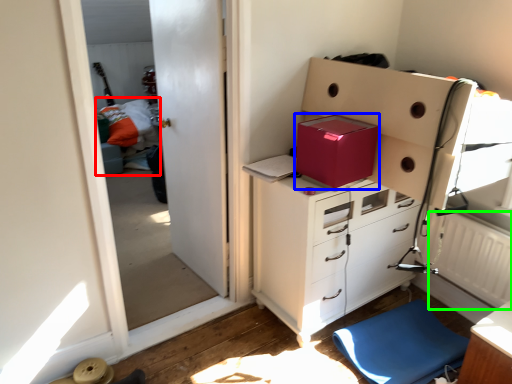
Question: Which object is the farthest from bed (highlighted by a red box)? Choose among these: cardboard box (highlighted by a blue box) or radiator (highlighted by a green box).

Choices:
 (A) cardboard box
 (B) radiator

Answer: (B)